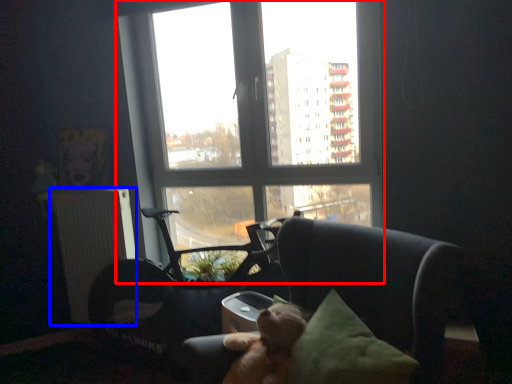
Question: Among these objects, which one is nearest to the camera, window (highlighted by a red box) or radiator (highlighted by a blue box)?

Choices:
 (A) window
 (B) radiator

Answer: (A)